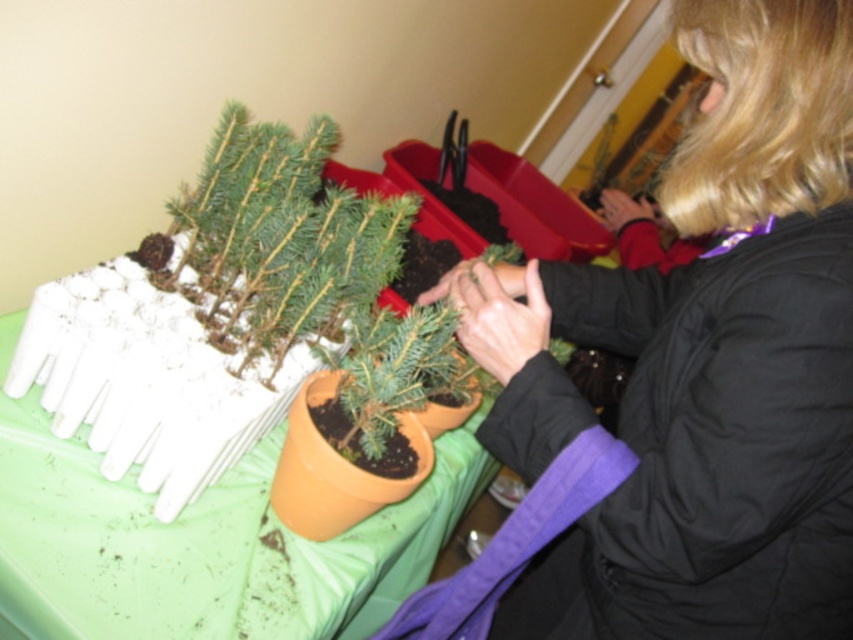
Locate an element on the screen. This screenshot has height=640, width=853. black jacket at center is located at coordinates (703, 362).

This screenshot has height=640, width=853. Describe the element at coordinates (703, 362) in the screenshot. I see `black jacket at center` at that location.

Identify the location of black jacket at center. This screenshot has height=640, width=853. (703, 362).